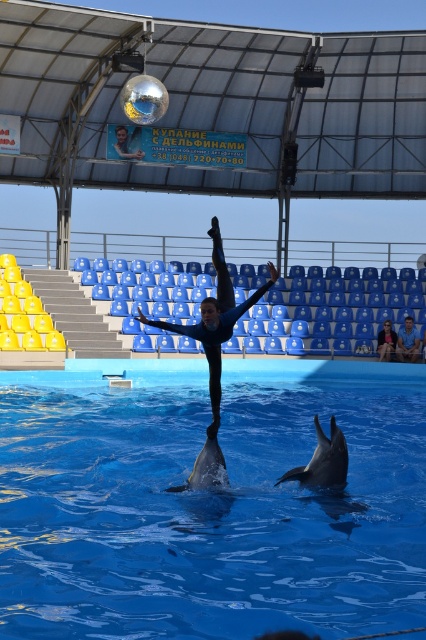
Question: Can you confirm if light brown leather jacket at lower right is bigger than matte black wetsuit at center?

Choices:
 (A) yes
 (B) no

Answer: (A)

Question: Does smooth gray dolphin at lower center appear on the right side of blue fabric pants at lower right?

Choices:
 (A) yes
 (B) no

Answer: (B)

Question: Is blue matte gymnast at center closer to camera compared to smooth gray dolphin at center?

Choices:
 (A) yes
 (B) no

Answer: (B)

Question: Which of the following is the farthest from the observer?

Choices:
 (A) smooth gray dolphin at lower center
 (B) light brown leather jacket at lower right
 (C) smooth gray dolphin at center

Answer: (B)

Question: Which of these objects is positioned farthest from the light brown leather jacket at lower right?

Choices:
 (A) smooth gray dolphin at center
 (B) blue matte gymnast at center
 (C) blue fabric pants at lower right
 (D) blue smooth water at center

Answer: (A)

Question: Based on their relative distances, which object is nearer to the blue matte gymnast at center?

Choices:
 (A) smooth gray dolphin at lower center
 (B) blue fabric pants at lower right
 (C) light brown leather jacket at lower right
 (D) blue smooth water at center

Answer: (A)